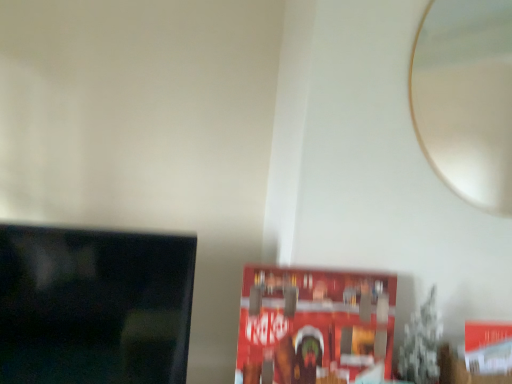
Question: From the image's perspective, is black glossy tv at left on red matte paperback book at center?

Choices:
 (A) yes
 (B) no

Answer: (A)

Question: Is black glossy tv at left closer to camera compared to red matte paperback book at center?

Choices:
 (A) yes
 (B) no

Answer: (A)

Question: Is black glossy tv at left thinner than red matte paperback book at center?

Choices:
 (A) yes
 (B) no

Answer: (B)

Question: Is black glossy tv at left turned away from red matte paperback book at center?

Choices:
 (A) yes
 (B) no

Answer: (B)

Question: Can you confirm if black glossy tv at left is smaller than red matte paperback book at center?

Choices:
 (A) yes
 (B) no

Answer: (B)

Question: Does black glossy tv at left turn towards red matte paperback book at center?

Choices:
 (A) no
 (B) yes

Answer: (A)

Question: From a real-world perspective, does red matte paperback book at center sit lower than black glossy tv at left?

Choices:
 (A) no
 (B) yes

Answer: (A)

Question: Is red matte paperback book at center surrounding black glossy tv at left?

Choices:
 (A) yes
 (B) no

Answer: (B)

Question: Is red matte paperback book at center smaller than black glossy tv at left?

Choices:
 (A) yes
 (B) no

Answer: (A)

Question: Is red matte paperback book at center at the right side of black glossy tv at left?

Choices:
 (A) no
 (B) yes

Answer: (B)

Question: Is the depth of red matte paperback book at center greater than that of black glossy tv at left?

Choices:
 (A) yes
 (B) no

Answer: (A)

Question: From the image's perspective, does red matte paperback book at center appear lower than black glossy tv at left?

Choices:
 (A) yes
 (B) no

Answer: (A)

Question: Can you confirm if white glossy mirror at upper right is positioned to the right of black glossy tv at left?

Choices:
 (A) yes
 (B) no

Answer: (A)